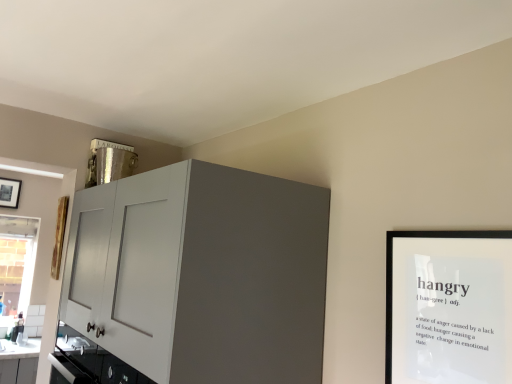
Question: Could clear glass window at lower left be considered to be inside black matte picture frame at upper right?

Choices:
 (A) yes
 (B) no

Answer: (B)

Question: Does black matte picture frame at upper right lie behind clear glass window at lower left?

Choices:
 (A) no
 (B) yes

Answer: (A)

Question: Considering the relative sizes of black matte picture frame at upper right and clear glass window at lower left in the image provided, is black matte picture frame at upper right bigger than clear glass window at lower left?

Choices:
 (A) no
 (B) yes

Answer: (A)

Question: From the image's perspective, does black matte picture frame at upper right appear lower than clear glass window at lower left?

Choices:
 (A) yes
 (B) no

Answer: (B)

Question: Is black matte picture frame at upper right not near clear glass window at lower left?

Choices:
 (A) no
 (B) yes

Answer: (B)

Question: Is black matte picture frame at upper right wider than clear glass window at lower left?

Choices:
 (A) yes
 (B) no

Answer: (B)

Question: Does clear glass window at lower left have a greater width compared to black matte picture frame at upper right?

Choices:
 (A) no
 (B) yes

Answer: (B)

Question: Does clear glass window at lower left have a greater height compared to black matte picture frame at upper right?

Choices:
 (A) no
 (B) yes

Answer: (B)

Question: Is the position of clear glass window at lower left more distant than that of black matte picture frame at upper right?

Choices:
 (A) yes
 (B) no

Answer: (A)

Question: Can you confirm if clear glass window at lower left is shorter than black matte picture frame at upper right?

Choices:
 (A) no
 (B) yes

Answer: (A)

Question: Considering the relative positions of clear glass window at lower left and black matte picture frame at upper right in the image provided, is clear glass window at lower left to the right of black matte picture frame at upper right from the viewer's perspective?

Choices:
 (A) no
 (B) yes

Answer: (A)

Question: Is black matte picture frame at upper right surrounded by clear glass window at lower left?

Choices:
 (A) yes
 (B) no

Answer: (B)

Question: Is black matte picture frame at upper right a part of matte white cabinet at upper left?

Choices:
 (A) no
 (B) yes

Answer: (A)